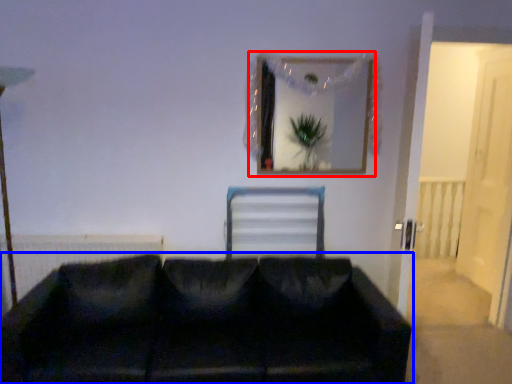
Question: Among these objects, which one is farthest to the camera, picture frame (highlighted by a red box) or studio couch (highlighted by a blue box)?

Choices:
 (A) picture frame
 (B) studio couch

Answer: (A)